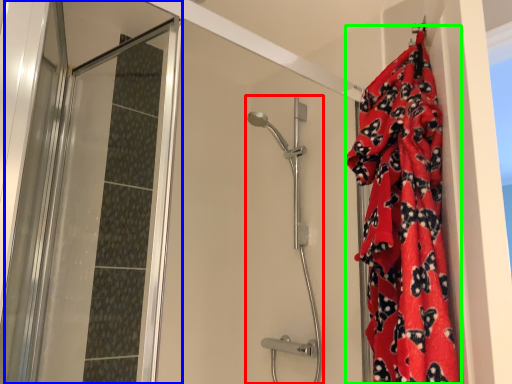
Question: Based on their relative distances, which object is nearer to shower door (highlighted by a red box)? Choose from screen door (highlighted by a blue box) and blanket (highlighted by a green box).

Choices:
 (A) screen door
 (B) blanket

Answer: (A)